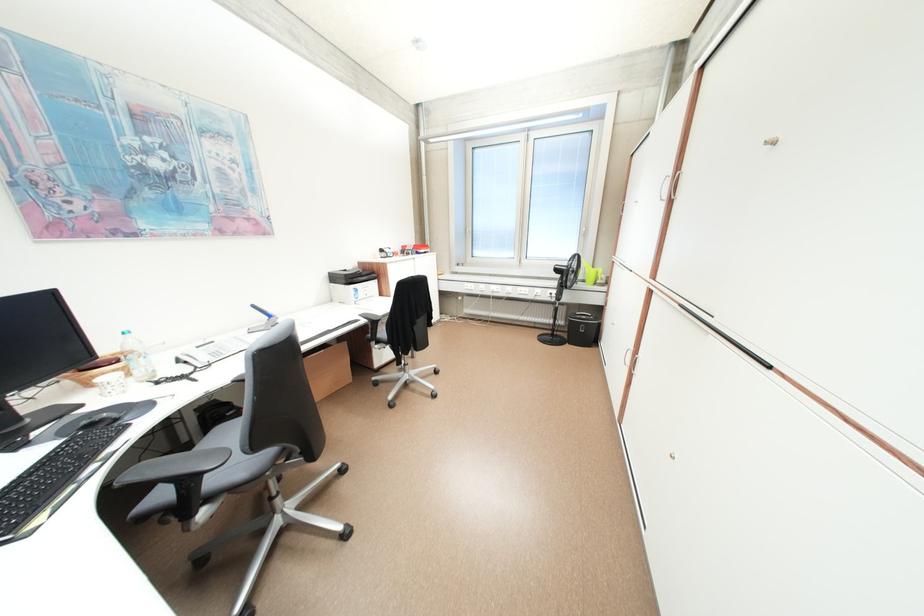
Identify the location of computer mouse. The height and width of the screenshot is (616, 924). (100, 419).